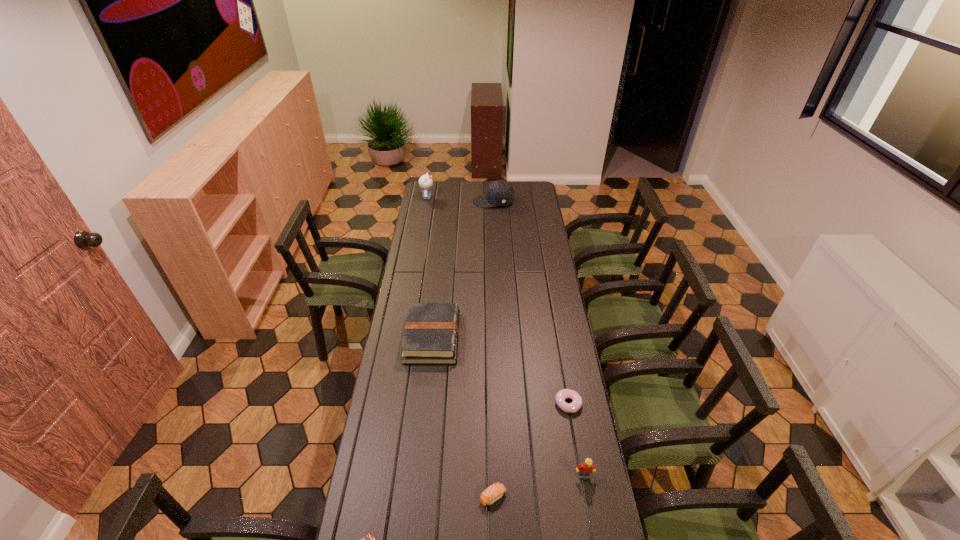
Identify the location of vacant point that satisfies the following two spatial constraints: 1. on the front-facing side of the kitten; 2. on the back side of the doughnut. This screenshot has height=540, width=960. (392, 404).

Identify the location of vacant space that satisfies the following two spatial constraints: 1. on the spine side of the hardback book; 2. on the right side of the fourth farthest object. Image resolution: width=960 pixels, height=540 pixels. 425,404.